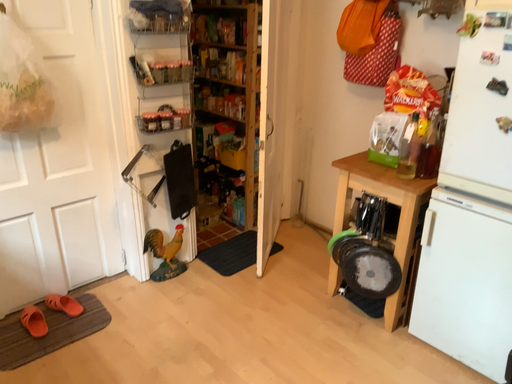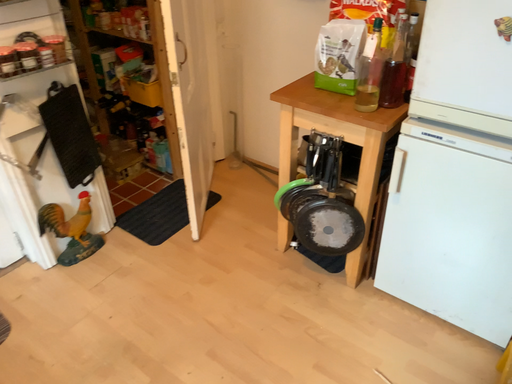
Question: How did the camera likely rotate when shooting the video?

Choices:
 (A) rotated left
 (B) rotated right

Answer: (B)